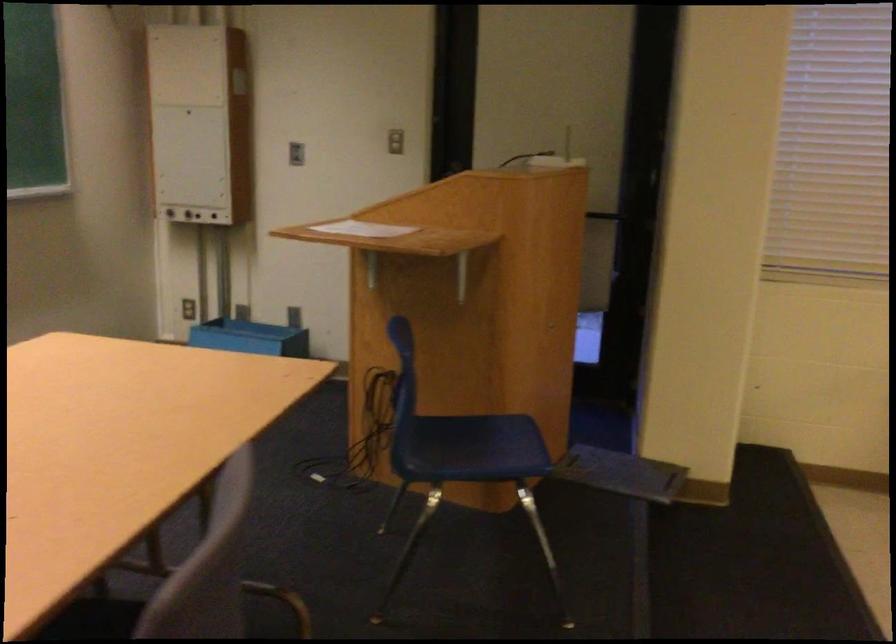
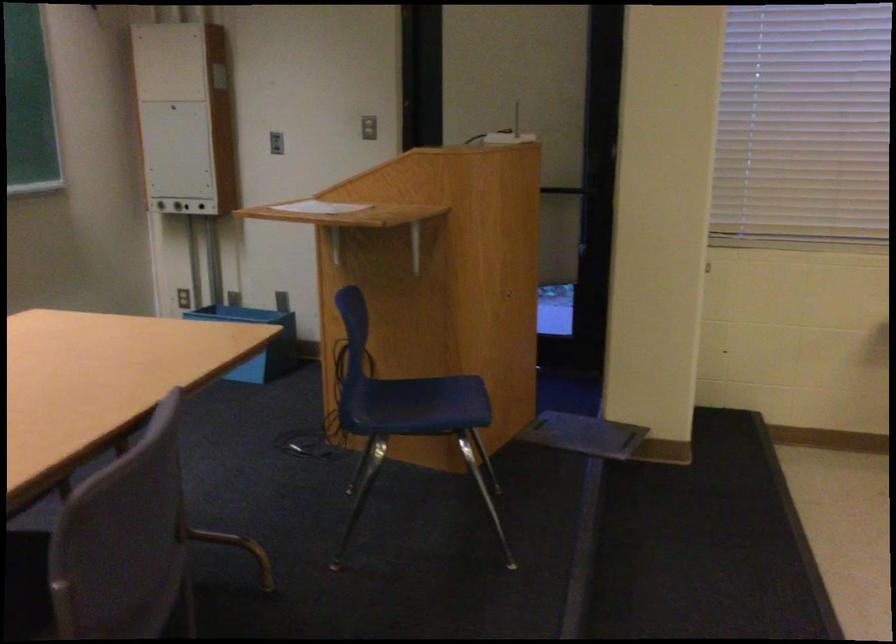
Find the pixel in the second image that matches (x=617, y=214) in the first image.

(583, 189)